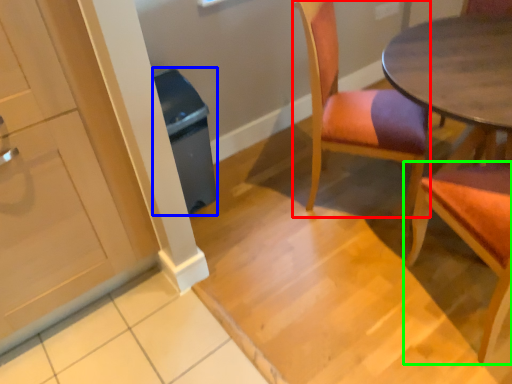
Question: Which is nearer to the chair (highlighted by a red box)? trash bin/can (highlighted by a blue box) or chair (highlighted by a green box).

Choices:
 (A) trash bin/can
 (B) chair

Answer: (B)